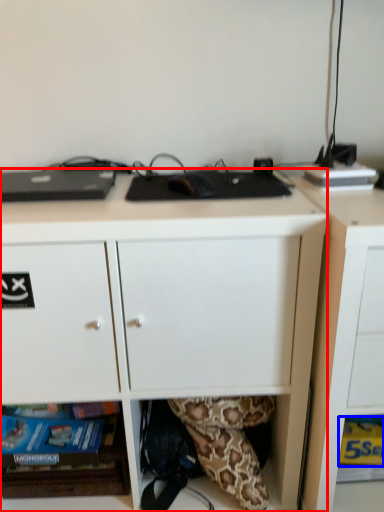
Question: Which object appears farthest to the camera in this image, desk (highlighted by a red box) or paperback book (highlighted by a blue box)?

Choices:
 (A) desk
 (B) paperback book

Answer: (B)